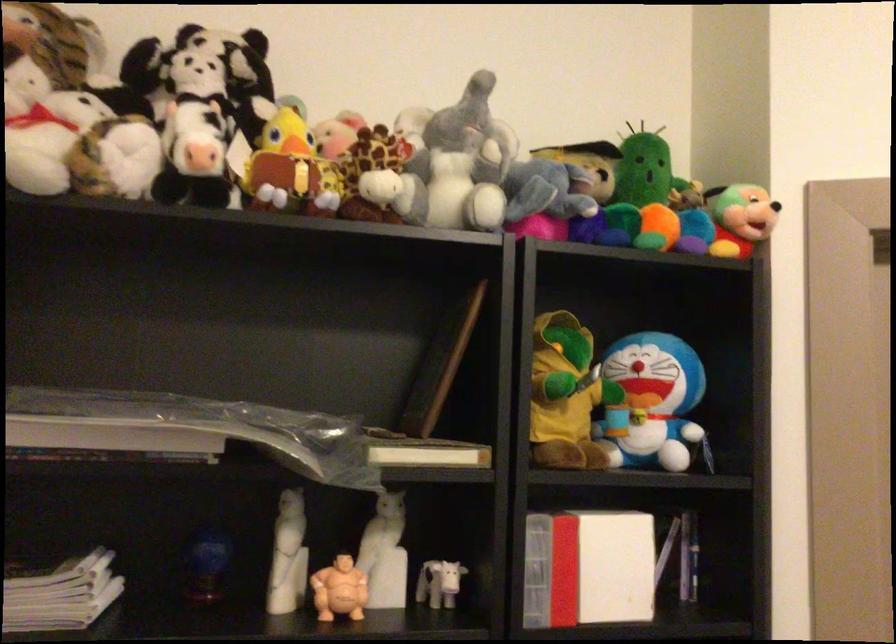
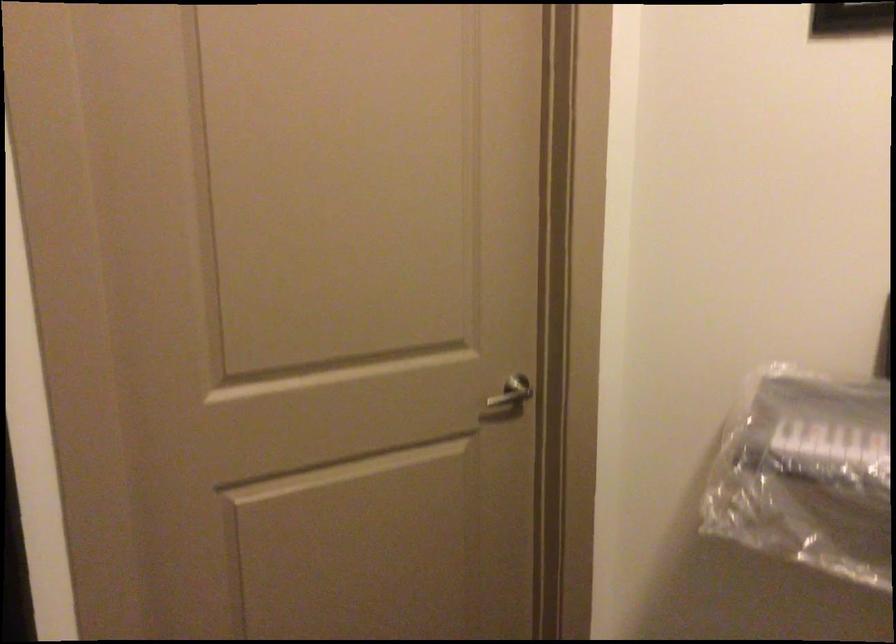
The images are taken continuously from a first-person perspective. In which direction is your viewpoint rotating?

The rotation direction of the camera is right-down.